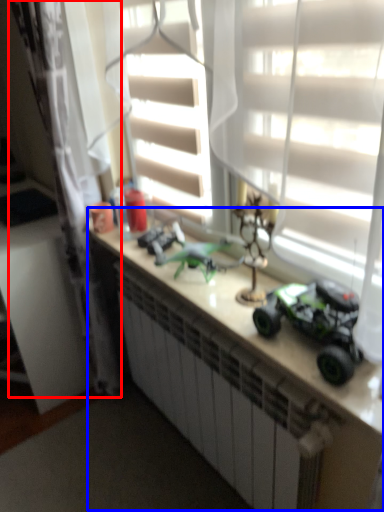
Question: Which object appears farthest to the camera in this image, curtain (highlighted by a red box) or counter (highlighted by a blue box)?

Choices:
 (A) curtain
 (B) counter

Answer: (A)